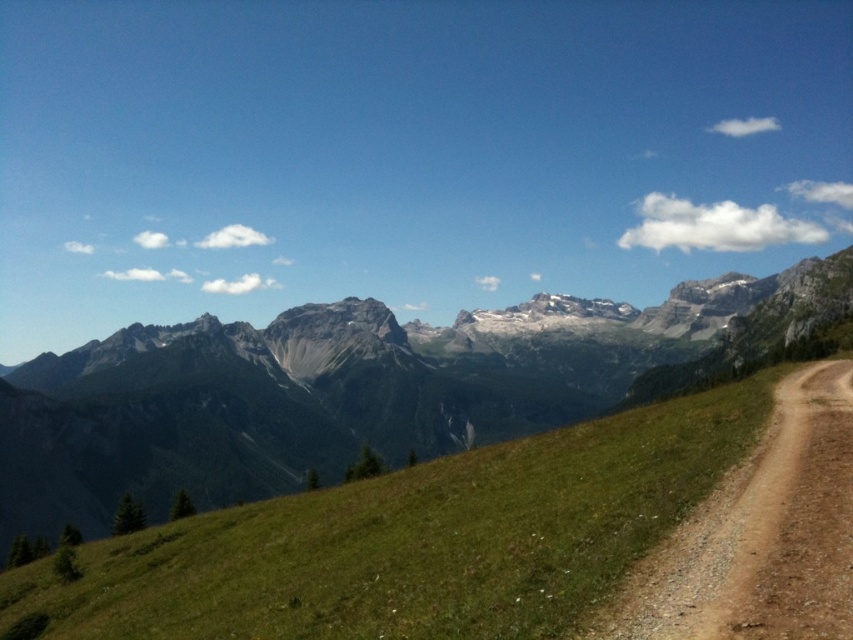
Looking at this image, is green grassy hillside at center above brown gravel path at right?

Incorrect, green grassy hillside at center is not positioned above brown gravel path at right.

Between point (421, 493) and point (657, 604), which one is positioned in front?

Positioned in front is point (657, 604).

Which is behind, point (247, 554) or point (666, 628)?

Positioned behind is point (247, 554).

Find the location of a particular element. The image size is (853, 640). green grassy hillside at center is located at coordinates (415, 540).

Is gray rocky mountain range at center closer to camera compared to green grassy hillside at center?

No, gray rocky mountain range at center is behind green grassy hillside at center.

Consider the image. Can you confirm if gray rocky mountain range at center is positioned to the left of green grassy hillside at center?

In fact, gray rocky mountain range at center is to the right of green grassy hillside at center.

Image resolution: width=853 pixels, height=640 pixels. Identify the location of gray rocky mountain range at center. (358, 388).

Can you confirm if gray rocky mountain range at center is positioned above brown gravel path at right?

Indeed, gray rocky mountain range at center is positioned over brown gravel path at right.

Does gray rocky mountain range at center have a smaller size compared to brown gravel path at right?

No, gray rocky mountain range at center is not smaller than brown gravel path at right.

Who is more forward, (219, 499) or (804, 413)?

Point (804, 413)

At what (x,y) coordinates should I click in order to perform the action: click on gray rocky mountain range at center. Please return your answer as a coordinate pair (x, y). Looking at the image, I should click on (358, 388).